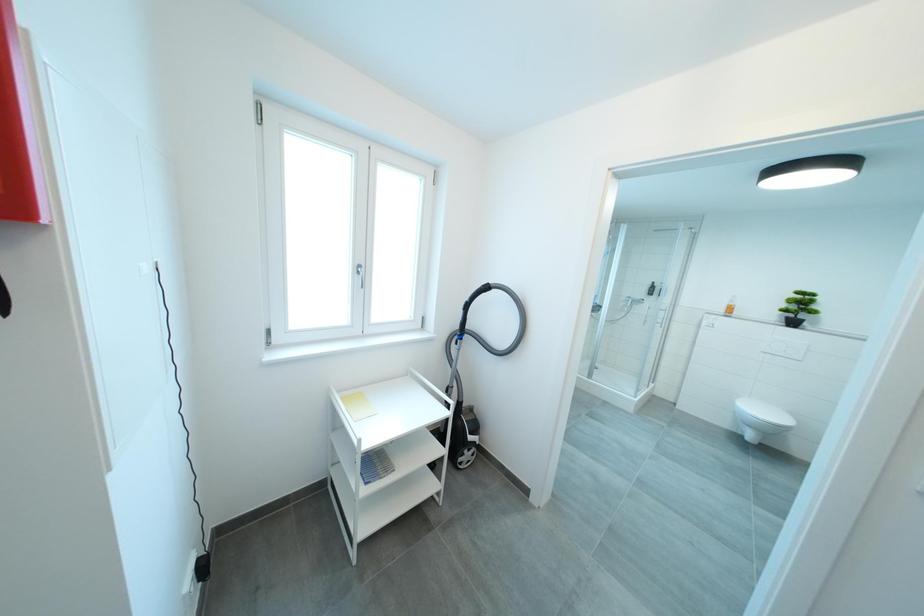
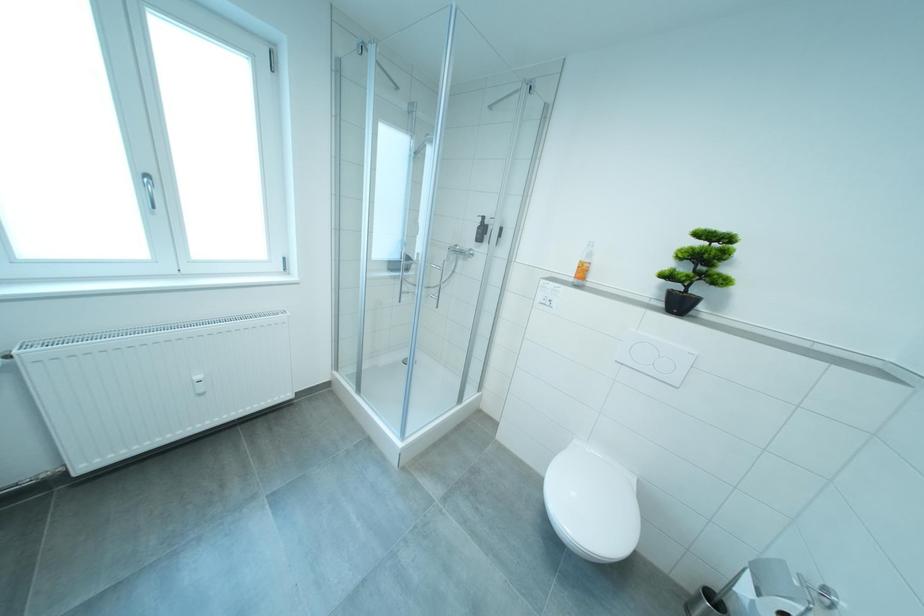
Which direction would the cameraman need to move to produce the second image?

The movement direction of the cameraman is right, forward.